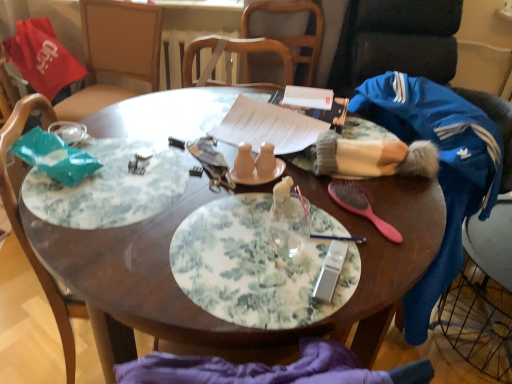
The width and height of the screenshot is (512, 384). What are the coordinates of `free space to the left of matte ceramic salt and pepper shakers at center, which is the first tableware in left-to-right order` in the screenshot? It's located at (175, 179).